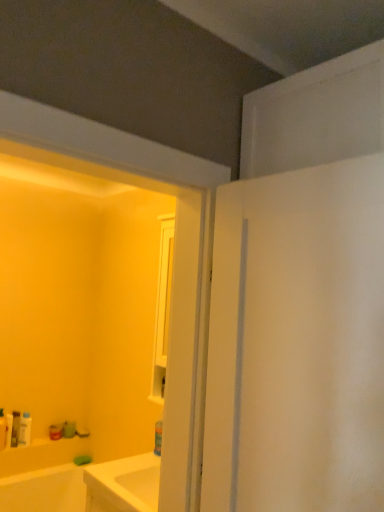
Question: Is white plastic bottle at lower left, positioned as the 3th toiletry in left-to-right order, not near matte white bottle at lower left, the first toiletry positioned from the left?

Choices:
 (A) no
 (B) yes

Answer: (A)

Question: Considering the relative sizes of white plastic bottle at lower left, positioned as the 3th toiletry in left-to-right order, and matte white bottle at lower left, the first toiletry positioned from the left, in the image provided, is white plastic bottle at lower left, positioned as the 3th toiletry in left-to-right order, wider than matte white bottle at lower left, the first toiletry positioned from the left,?

Choices:
 (A) yes
 (B) no

Answer: (B)

Question: Is white plastic bottle at lower left, the 3th toiletry from the right, turned away from matte white bottle at lower left, which ranks as the 5th toiletry in right-to-left order?

Choices:
 (A) no
 (B) yes

Answer: (A)

Question: Considering the relative sizes of white plastic bottle at lower left, the 3th toiletry from the right, and matte white bottle at lower left, the first toiletry positioned from the left, in the image provided, is white plastic bottle at lower left, the 3th toiletry from the right, smaller than matte white bottle at lower left, the first toiletry positioned from the left,?

Choices:
 (A) no
 (B) yes

Answer: (B)

Question: From a real-world perspective, is white plastic bottle at lower left, positioned as the 3th toiletry in left-to-right order, on top of matte white bottle at lower left, the first toiletry positioned from the left?

Choices:
 (A) no
 (B) yes

Answer: (A)

Question: Considering their positions, is white plastic bottle at lower left, positioned as the 3th toiletry in left-to-right order, located in front of or behind matte white tube at lower left, the fourth toiletry from the right?

Choices:
 (A) front
 (B) behind

Answer: (B)

Question: Is white plastic bottle at lower left, the 3th toiletry from the right, to the left or to the right of matte white tube at lower left, the second toiletry in the left-to-right sequence, in the image?

Choices:
 (A) right
 (B) left

Answer: (A)

Question: From the image's perspective, relative to matte white tube at lower left, the fourth toiletry from the right, is white plastic bottle at lower left, positioned as the 3th toiletry in left-to-right order, above or below?

Choices:
 (A) above
 (B) below

Answer: (B)

Question: Does point (16, 432) appear closer or farther from the camera than point (8, 422)?

Choices:
 (A) closer
 (B) farther

Answer: (B)

Question: From a real-world perspective, is matte green soap at lower left, the fifth toiletry viewed from the left, above or below matte white tube at lower left, the fourth toiletry from the right?

Choices:
 (A) below
 (B) above

Answer: (A)

Question: From the image's perspective, is matte green soap at lower left, positioned as the first toiletry in right-to-left order, positioned above or below matte white tube at lower left, the second toiletry in the left-to-right sequence?

Choices:
 (A) below
 (B) above

Answer: (A)

Question: Is point (72, 425) closer or farther from the camera than point (8, 431)?

Choices:
 (A) farther
 (B) closer

Answer: (A)

Question: Looking at the image, does matte green soap at lower left, the fifth toiletry viewed from the left, seem bigger or smaller compared to matte white tube at lower left, the second toiletry in the left-to-right sequence?

Choices:
 (A) big
 (B) small

Answer: (A)

Question: From the image's perspective, is matte white tube at lower left, the second toiletry in the left-to-right sequence, positioned above or below matte white bottle at lower left, which ranks as the 5th toiletry in right-to-left order?

Choices:
 (A) below
 (B) above

Answer: (A)

Question: Is matte white tube at lower left, the fourth toiletry from the right, to the left or to the right of matte white bottle at lower left, which ranks as the 5th toiletry in right-to-left order, in the image?

Choices:
 (A) left
 (B) right

Answer: (B)